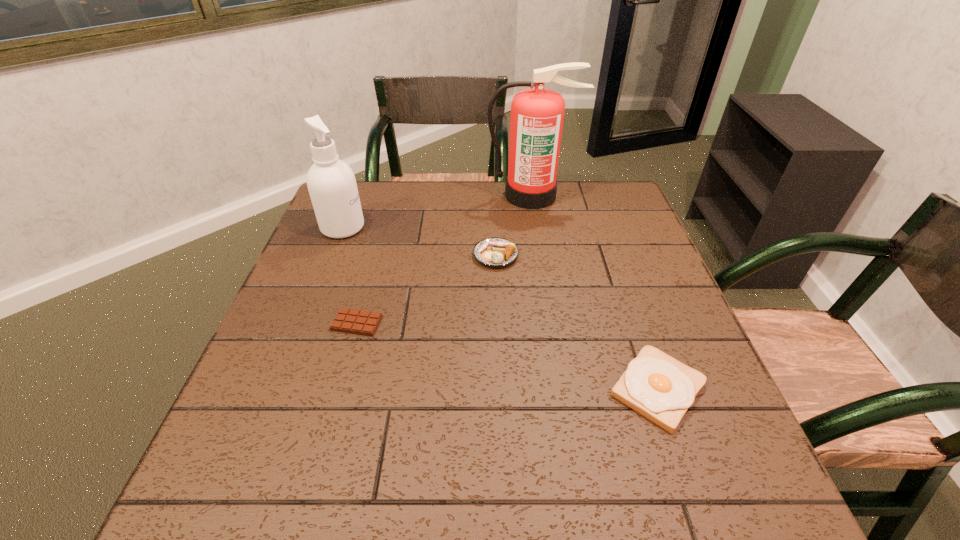
Locate an element on the screen. The height and width of the screenshot is (540, 960). vacant space located at the nozzle of the tallest object is located at coordinates (546, 288).

The width and height of the screenshot is (960, 540). In order to click on vacant area located on the front label of the cleansing agent in this screenshot , I will do `click(414, 227)`.

Identify the location of free location located on the right of the third nearest object. The width and height of the screenshot is (960, 540). (591, 255).

Identify the location of vacant space located on the back of the second shortest object. (628, 302).

Where is `free space located on the back of the shortest object`? free space located on the back of the shortest object is located at coordinates (386, 220).

This screenshot has width=960, height=540. In order to click on fire extinguisher that is at the far edge in this screenshot , I will do `click(537, 114)`.

Identify the location of cleansing agent at the far edge. (331, 183).

Where is `cleansing agent present at the left edge`? cleansing agent present at the left edge is located at coordinates (331, 183).

At what (x,y) coordinates should I click in order to perform the action: click on candy bar positioned at the left edge. Please return your answer as a coordinate pair (x, y). The image size is (960, 540). Looking at the image, I should click on (361, 322).

Where is `fire extinguisher at the right edge`? fire extinguisher at the right edge is located at coordinates (537, 114).